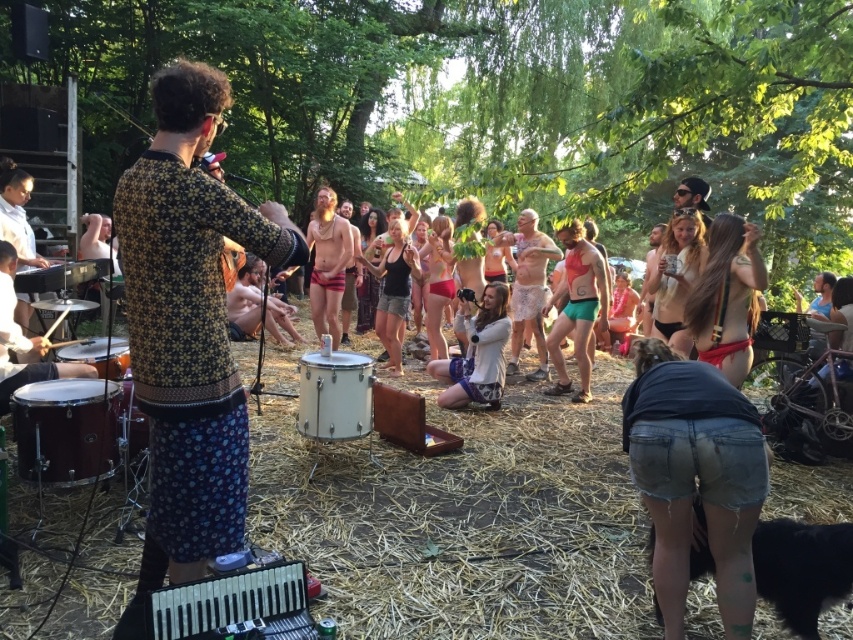
Is orange fabric shorts at center smaller than matte red underwear at center?

Yes.

Who is positioned more to the left, orange fabric shorts at center or matte red underwear at center?

matte red underwear at center

At what (x,y) coordinates should I click in order to perform the action: click on orange fabric shorts at center. Please return your answer as a coordinate pair (x, y). Looking at the image, I should click on (577, 308).

Find the location of a particular element. This screenshot has height=640, width=853. orange fabric shorts at center is located at coordinates (577, 308).

Can you confirm if light gray sweater at center is positioned to the left of metallic drum at left?

No, light gray sweater at center is not to the left of metallic drum at left.

Does light gray sweater at center have a smaller size compared to metallic drum at left?

Yes, light gray sweater at center is smaller than metallic drum at left.

The image size is (853, 640). I want to click on light gray sweater at center, so click(477, 355).

Identify the location of light gray sweater at center. (477, 355).

Between white metallic drum at center and metallic drum at left, which one appears on the left side from the viewer's perspective?

From the viewer's perspective, metallic drum at left appears more on the left side.

Is point (354, 433) more distant than point (102, 272)?

No, it is in front of (102, 272).

The width and height of the screenshot is (853, 640). I want to click on white metallic drum at center, so click(x=335, y=396).